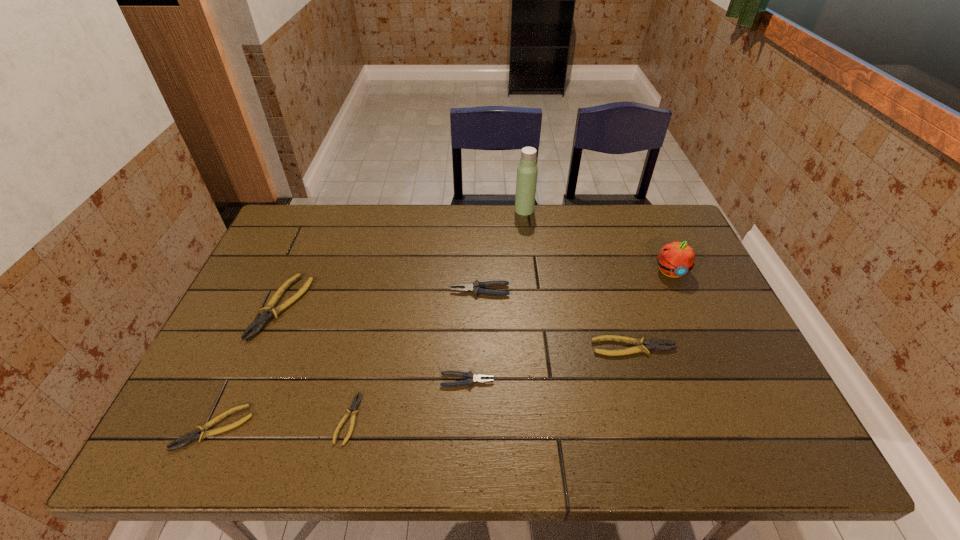
In the image, there is a desktop. Where is `vacant region at the right edge`? The height and width of the screenshot is (540, 960). vacant region at the right edge is located at coordinates (695, 296).

Find the location of `free space at the far left corner of the desktop`. free space at the far left corner of the desktop is located at coordinates (317, 212).

At what (x,y) coordinates should I click in order to perform the action: click on vacant area at the far right corner. Please return your answer as a coordinate pair (x, y). This screenshot has height=540, width=960. Looking at the image, I should click on (652, 217).

Locate an element on the screen. Image resolution: width=960 pixels, height=540 pixels. vacant area at the near right corner is located at coordinates (760, 451).

The image size is (960, 540). I want to click on free space between the nearer gray pliers and the second shortest pliers, so click(341, 404).

You are a GUI agent. You are given a task and a screenshot of the screen. Output one action in this format:
    pyautogui.click(x=<x>, y=<y>)
    Task: Click on the unoccupied position between the sixth object from right to left and the bigger gray pliers
    
    Given the screenshot: What is the action you would take?
    pyautogui.click(x=414, y=355)

I want to click on empty location between the seventh tallest object and the apple, so click(x=442, y=350).

Locate an element on the screen. The image size is (960, 540). free space between the second shortest pliers and the rightmost yellow pliers is located at coordinates (423, 388).

The width and height of the screenshot is (960, 540). I want to click on free space between the biggest yellow pliers and the rightmost yellow pliers, so click(x=458, y=327).

I want to click on free space that is in between the farther gray pliers and the thermos bottle, so click(502, 251).